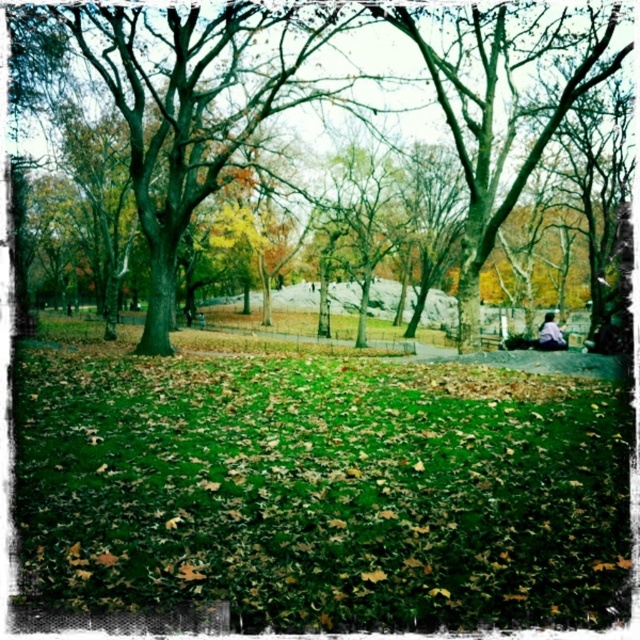
Question: Can you confirm if green grassy field at center is smaller than green leafy tree at center?

Choices:
 (A) no
 (B) yes

Answer: (B)

Question: Which of the following is the closest to the observer?

Choices:
 (A) green grassy field at center
 (B) green leafy tree at center

Answer: (A)

Question: Which object is farther from the camera taking this photo?

Choices:
 (A) green leafy tree at center
 (B) green grassy field at center

Answer: (A)

Question: Which object appears closest to the camera in this image?

Choices:
 (A) green leafy tree at center
 (B) green grassy field at center

Answer: (B)

Question: Is green grassy field at center above green leafy tree at center?

Choices:
 (A) yes
 (B) no

Answer: (B)

Question: Can you confirm if green grassy field at center is positioned above green leafy tree at center?

Choices:
 (A) no
 (B) yes

Answer: (A)